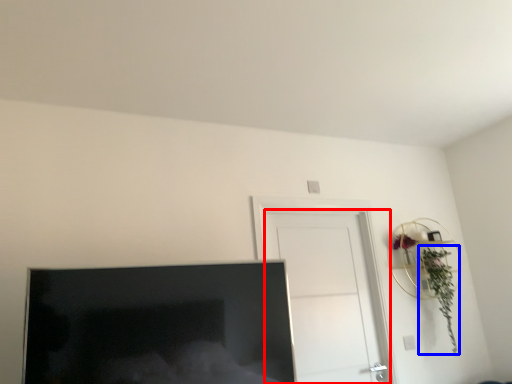
Question: Which object is further to the camera taking this photo, door (highlighted by a red box) or plant (highlighted by a blue box)?

Choices:
 (A) door
 (B) plant

Answer: (B)